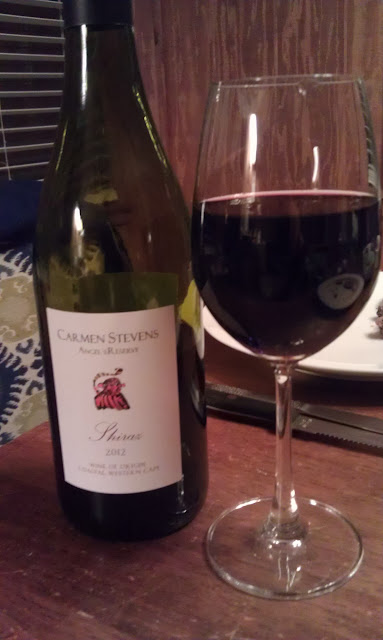
Where is `cup`? The height and width of the screenshot is (640, 383). cup is located at coordinates (276, 312).